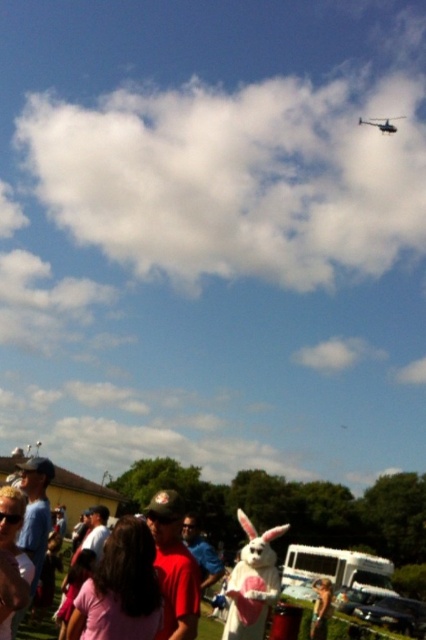
Question: Can you confirm if white plush rabbit at center is positioned to the right of metallic silver helicopter at upper right?

Choices:
 (A) no
 (B) yes

Answer: (A)

Question: Considering the relative positions of white plush rabbit at center and metallic silver helicopter at upper right in the image provided, where is white plush rabbit at center located with respect to metallic silver helicopter at upper right?

Choices:
 (A) above
 (B) below

Answer: (B)

Question: Is white plush rabbit at center positioned in front of metallic silver helicopter at upper right?

Choices:
 (A) yes
 (B) no

Answer: (A)

Question: Among these points, which one is farthest from the camera?

Choices:
 (A) (238, 627)
 (B) (388, 125)

Answer: (B)

Question: Which point appears closest to the camera in this image?

Choices:
 (A) (230, 589)
 (B) (385, 128)

Answer: (A)